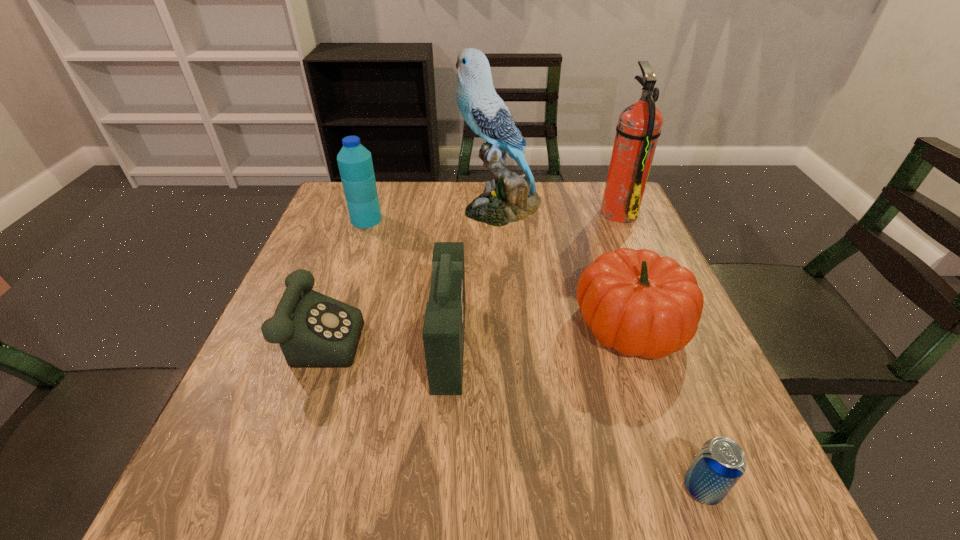
What are the coordinates of `empty space that is in between the third shortest object and the parakeet` in the screenshot? It's located at (566, 266).

Where is `vacant point located between the telephone and the water bottle`? This screenshot has height=540, width=960. vacant point located between the telephone and the water bottle is located at coordinates (344, 274).

Identify the location of vacant space that is in between the telephone and the water bottle. This screenshot has height=540, width=960. click(x=344, y=274).

At what (x,y) coordinates should I click in order to perform the action: click on free space that is in between the parakeet and the second shortest object. Please return your answer as a coordinate pair (x, y). The height and width of the screenshot is (540, 960). Looking at the image, I should click on (411, 267).

This screenshot has height=540, width=960. What are the coordinates of `free spot between the fire extinguisher and the sixth tallest object` in the screenshot? It's located at (469, 269).

Image resolution: width=960 pixels, height=540 pixels. In order to click on object that is the sixth closest to the fire extinguisher in this screenshot , I will do `click(720, 463)`.

Select which object is the sixth closest to the water bottle. Please provide its 2D coordinates. Your answer should be formatted as a tuple, i.e. [(x, y)], where the tuple contains the x and y coordinates of a point satisfying the conditions above.

[(720, 463)]

Find the location of a particular element. vacant region that satisfies the following two spatial constraints: 1. on the back side of the beer can; 2. on the dial of the second shortest object is located at coordinates (642, 327).

Identify the location of free space that satisfies the following two spatial constraints: 1. on the front side of the water bottle; 2. on the left side of the pumpkin. This screenshot has height=540, width=960. (329, 325).

Find the location of a particular element. This screenshot has width=960, height=540. free space that satisfies the following two spatial constraints: 1. on the face of the parakeet; 2. on the front side of the water bottle is located at coordinates (502, 220).